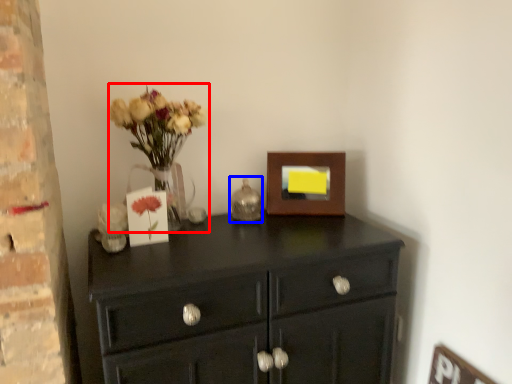
Question: Which point is further to the camera, floral arrangement (highlighted by a red box) or candle holder (highlighted by a blue box)?

Choices:
 (A) floral arrangement
 (B) candle holder

Answer: (B)